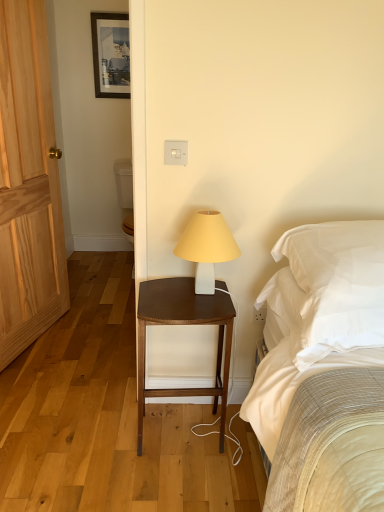
At what (x,y) coordinates should I click in order to perform the action: click on vacant space situated on the left part of white matte lamp at center. Please return your answer as a coordinate pair (x, y). The image size is (384, 512). Looking at the image, I should click on (162, 292).